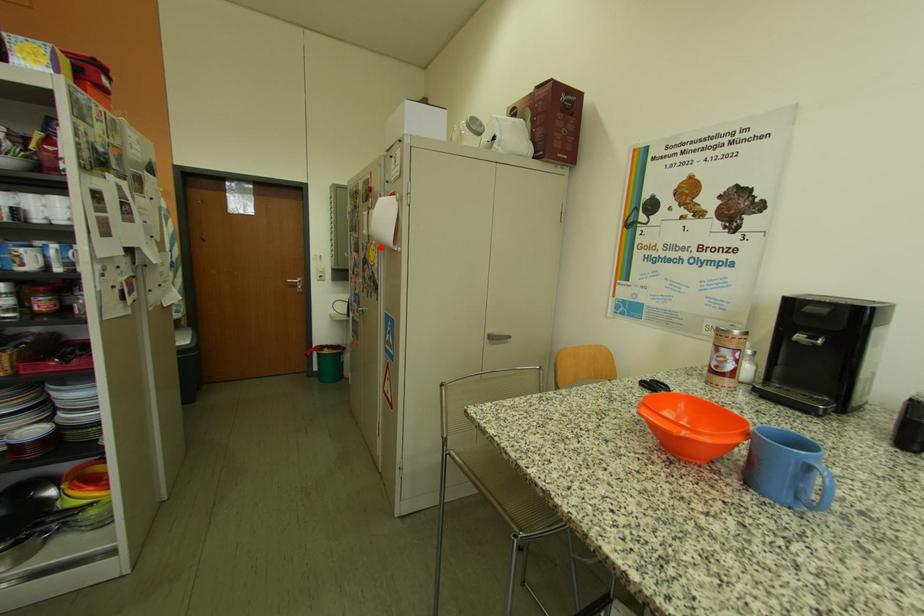
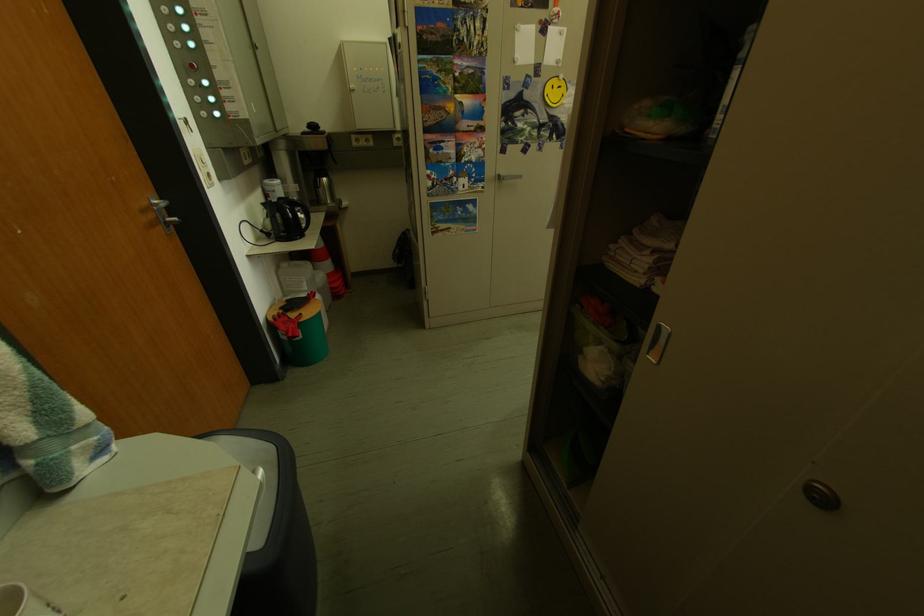
The point at the highlighted location is marked in the first image. Where is the corresponding point in the second image?

(546, 82)